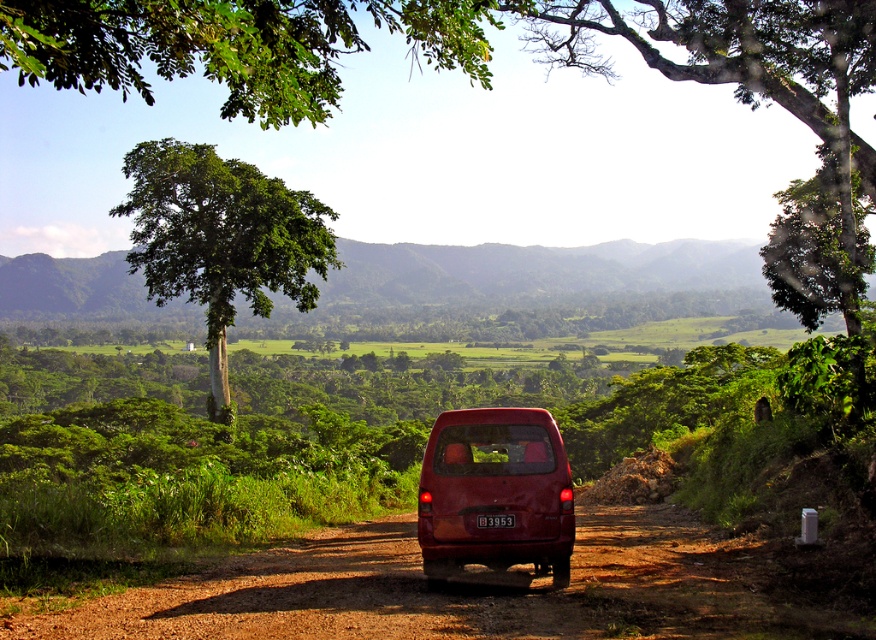
Does point (126, 596) come in front of point (175, 200)?

Yes, it is.

Describe the element at coordinates (467, 589) in the screenshot. This screenshot has width=876, height=640. I see `dusty brown dirt track at center` at that location.

Locate an element on the screen. The height and width of the screenshot is (640, 876). dusty brown dirt track at center is located at coordinates (467, 589).

Can you confirm if dusty brown dirt track at center is wider than matte red van at center?

Yes.

Between point (163, 602) and point (516, 509), which one is positioned in front?

Point (163, 602)

Does point (583, 624) come farther from viewer compared to point (427, 579)?

No, (583, 624) is in front of (427, 579).

This screenshot has height=640, width=876. Identify the location of dusty brown dirt track at center. (467, 589).

Does dusty brown dirt track at center have a greater height compared to red plastic license plate at rear center?

Yes, dusty brown dirt track at center is taller than red plastic license plate at rear center.

Which is more to the right, dusty brown dirt track at center or red plastic license plate at rear center?

red plastic license plate at rear center is more to the right.

Is point (251, 556) farther from camera compared to point (504, 525)?

Yes, point (251, 556) is behind point (504, 525).

Find the location of `dusty brown dirt track at center`. dusty brown dirt track at center is located at coordinates (467, 589).